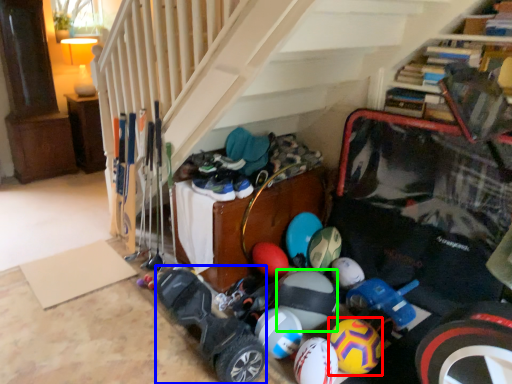
Question: Considering the real-world distances, which object is farthest from bowling ball (highlighted by a red box)? wide (highlighted by a blue box) or beach ball (highlighted by a green box)?

Choices:
 (A) wide
 (B) beach ball

Answer: (A)